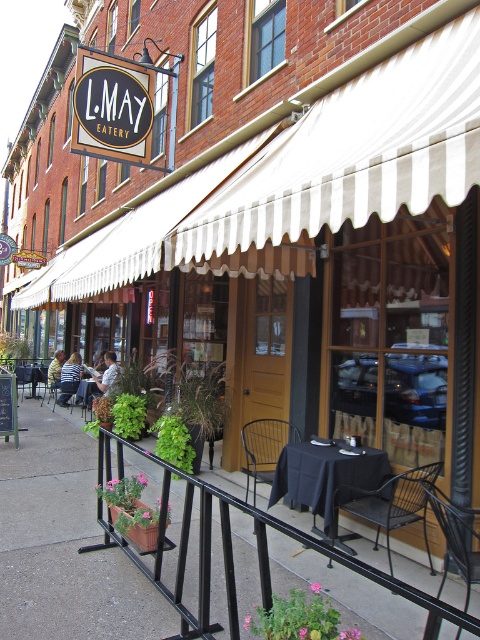
Question: Which point is farther to the camera?

Choices:
 (A) matte black chair at lower left
 (B) white striped awning at center
 (C) wooden chair at lower left
 (D) striped shirt at lower left

Answer: (C)

Question: Where is black wire chair at lower center located in relation to wooden chair at lower left in the image?

Choices:
 (A) right
 (B) left

Answer: (A)

Question: Which of these objects is positioned farthest from the black metal/rail at lower center?

Choices:
 (A) black metal chair at lower center
 (B) light brown hair at center

Answer: (B)

Question: Does striped shirt at center have a greater width compared to matte black chair at lower left?

Choices:
 (A) no
 (B) yes

Answer: (B)

Question: Can you confirm if black metal chair at lower center is positioned to the left of matte black chair at lower left?

Choices:
 (A) no
 (B) yes

Answer: (A)

Question: Among these objects, which one is nearest to the camera?

Choices:
 (A) black cloth table at center
 (B) striped shirt at center
 (C) light brown hair at center
 (D) matte black chair at lower left

Answer: (A)